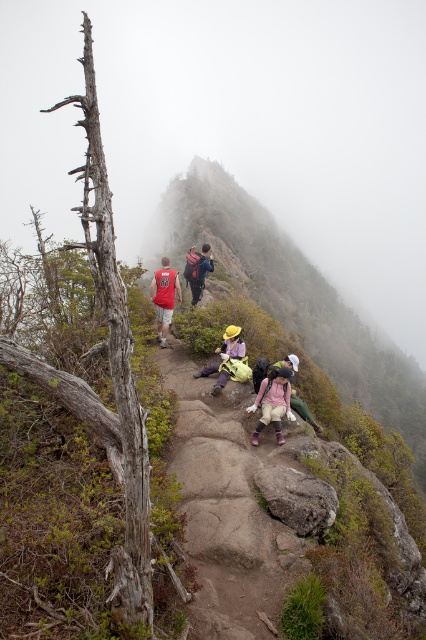
Who is positioned more to the right, rough stone trail at center or yellow fabric hat at center?

rough stone trail at center

Who is more distant from viewer, (278,532) or (201,369)?

Point (201,369)

Which is in front, point (201, 586) or point (222, 358)?

Point (201, 586) is in front.

I want to click on rough stone trail at center, so click(x=224, y=509).

Does khaki pants at center appear over matte red backpack at center?

No.

Identify the location of khaki pants at center. pyautogui.click(x=273, y=403).

Image resolution: width=426 pixels, height=640 pixels. Identify the location of khaki pants at center. (273, 403).

Can you confirm if yellow fabric hat at center is taller than matte red backpack at center?

In fact, yellow fabric hat at center may be shorter than matte red backpack at center.

Can you confirm if yellow fabric hat at center is positioned above matte red backpack at center?

Incorrect, yellow fabric hat at center is not positioned above matte red backpack at center.

At what (x,y) coordinates should I click in order to perform the action: click on yellow fabric hat at center. Please return your answer as a coordinate pair (x, y). This screenshot has width=426, height=640. Looking at the image, I should click on (224, 356).